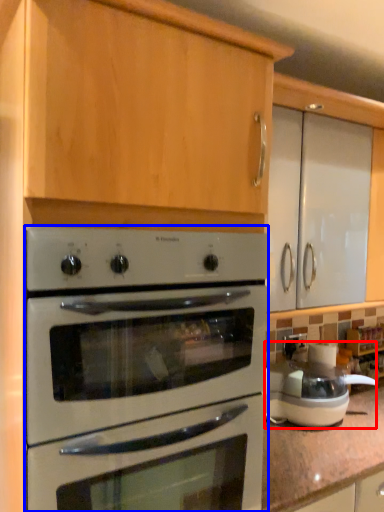
Question: Which object is closer to the camera taking this photo, appliance (highlighted by a red box) or oven (highlighted by a blue box)?

Choices:
 (A) appliance
 (B) oven

Answer: (B)